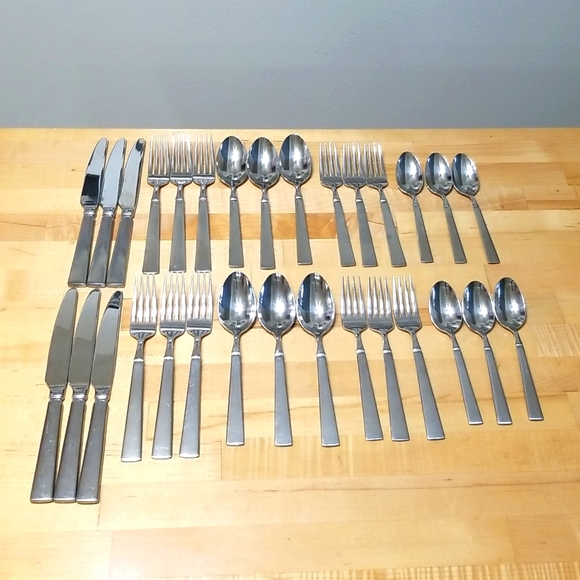
In order to click on knives in this screenshot , I will do `click(90, 200)`, `click(104, 201)`, `click(125, 213)`, `click(63, 324)`, `click(78, 332)`, `click(113, 350)`.